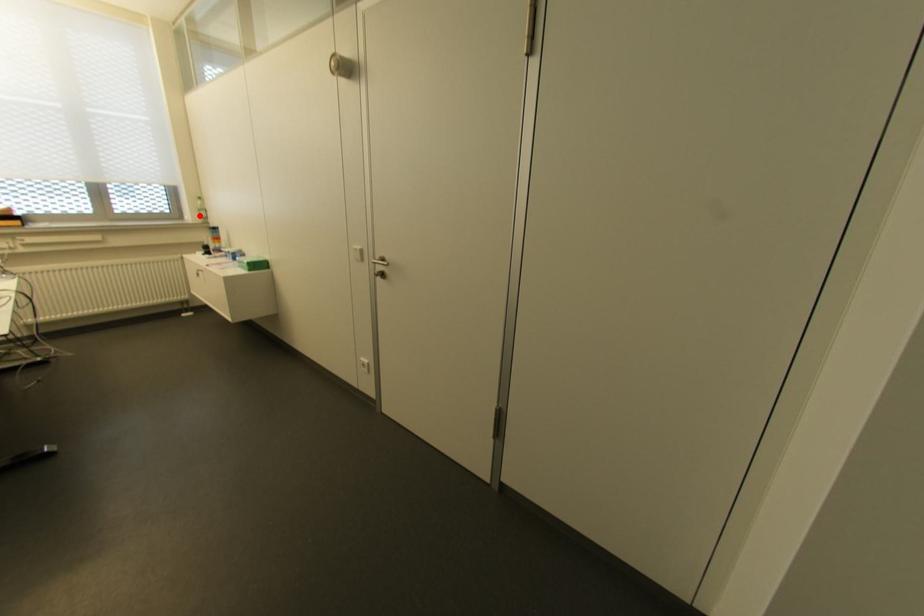
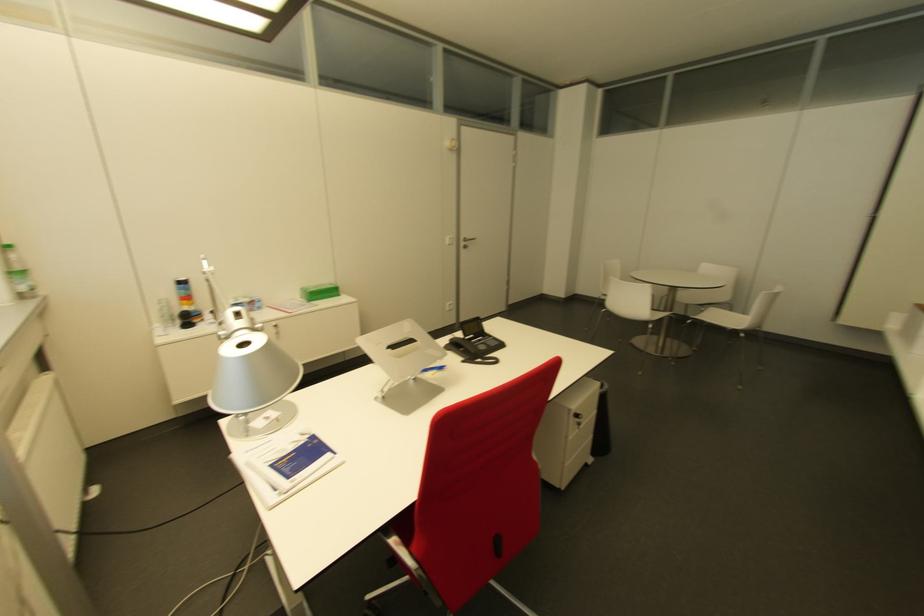
Question: I am providing you with two images of the same scene from different viewpoints. A red point is shown in image1. For the corresponding object point in image2, is it positioned nearer or farther from the camera?

Choices:
 (A) Nearer
 (B) Farther

Answer: (B)